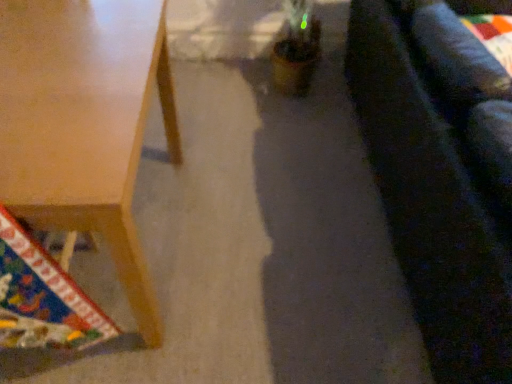
Question: In terms of size, does dark blue fabric couch at right appear bigger or smaller than light brown wooden table at lower left?

Choices:
 (A) small
 (B) big

Answer: (B)

Question: Which is correct: dark blue fabric couch at right is inside light brown wooden table at lower left, or outside of it?

Choices:
 (A) inside
 (B) outside

Answer: (B)

Question: From the image's perspective, is dark blue fabric couch at right above or below light brown wooden table at lower left?

Choices:
 (A) below
 (B) above

Answer: (B)

Question: Is point (60, 28) closer or farther from the camera than point (508, 261)?

Choices:
 (A) closer
 (B) farther

Answer: (B)

Question: From their relative heights in the image, would you say light brown wooden table at lower left is taller or shorter than dark blue fabric couch at right?

Choices:
 (A) short
 (B) tall

Answer: (A)

Question: Relative to dark blue fabric couch at right, is light brown wooden table at lower left in front or behind?

Choices:
 (A) behind
 (B) front

Answer: (A)

Question: From a real-world perspective, is light brown wooden table at lower left positioned above or below dark blue fabric couch at right?

Choices:
 (A) below
 (B) above

Answer: (A)